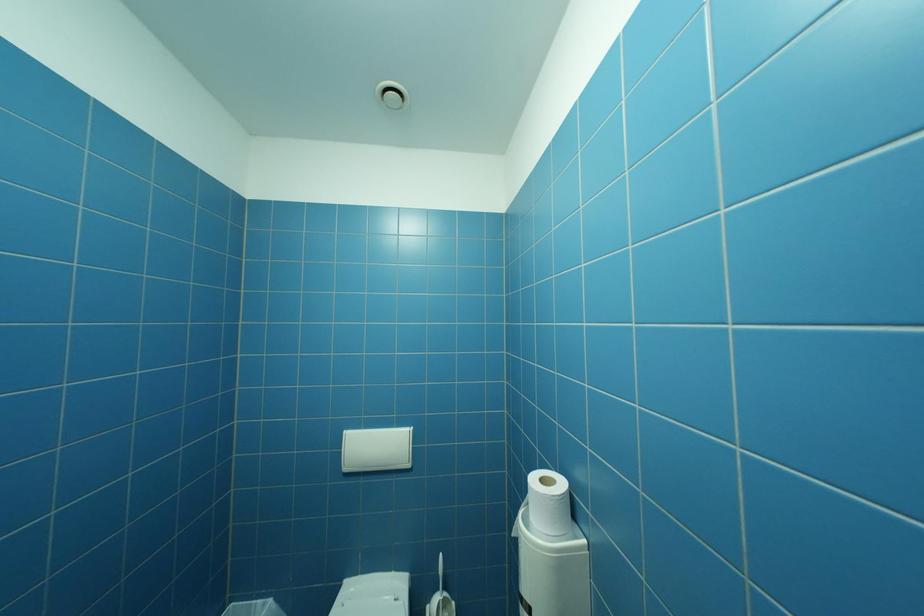
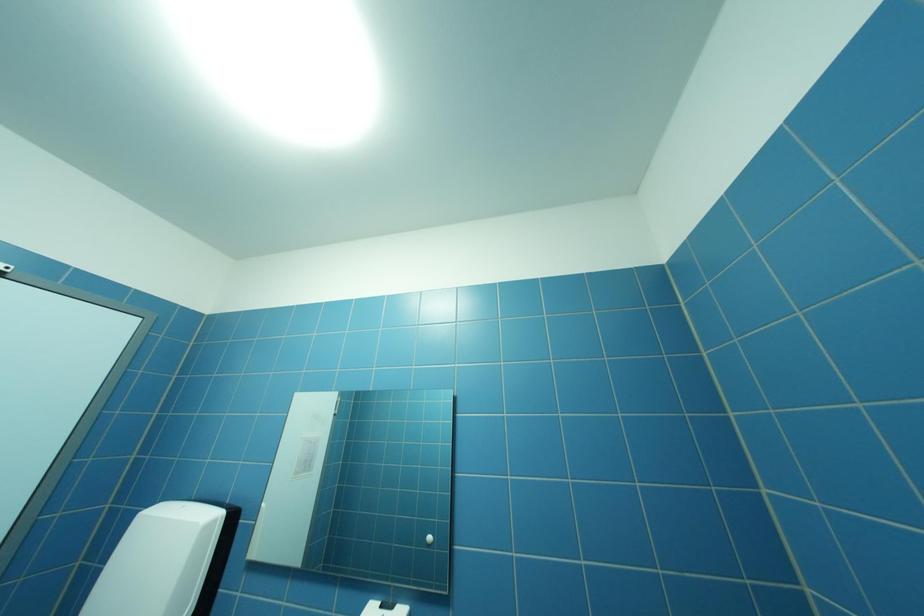
Based on the continuous images, in which direction is the camera rotating?

The camera rotated toward left-up.